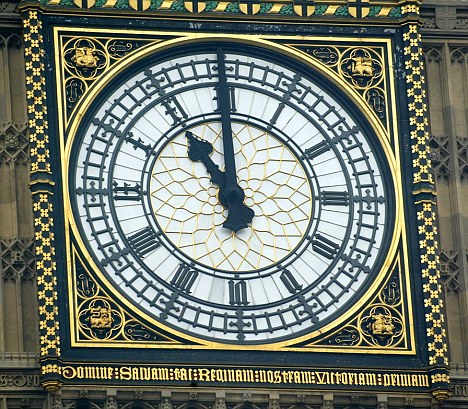
Image resolution: width=468 pixels, height=409 pixels. Identify the location of clock face. (119, 178).